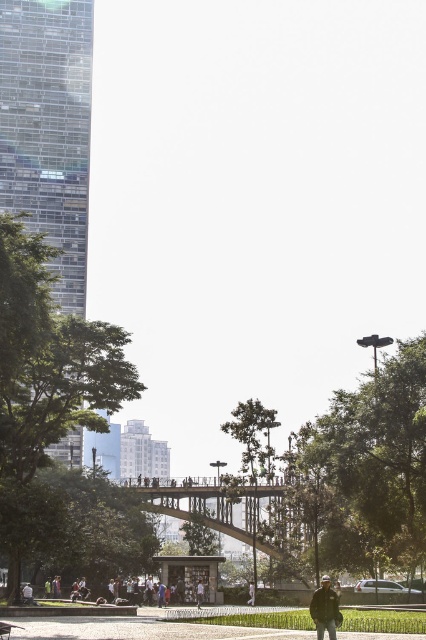
Question: Among these points, which one is farthest from the camera?

Choices:
 (A) (196, 600)
 (B) (322, 632)
 (C) (253, 596)

Answer: (A)

Question: Is dark blue jacket at lower center closer to the viewer compared to light brown leather jacket at center?

Choices:
 (A) no
 (B) yes

Answer: (B)

Question: Which point is farther to the camera?

Choices:
 (A) (250, 586)
 (B) (333, 611)

Answer: (A)

Question: Is dark blue jacket at lower center bigger than white fabric shirt at center?

Choices:
 (A) yes
 (B) no

Answer: (A)

Question: Is dark blue jacket at lower center wider than light brown leather jacket at center?

Choices:
 (A) no
 (B) yes

Answer: (B)

Question: Estimate the real-world distances between objects in this image. Which object is farther from the white fabric shirt at center?

Choices:
 (A) dark blue jacket at lower center
 (B) light brown leather jacket at center

Answer: (A)